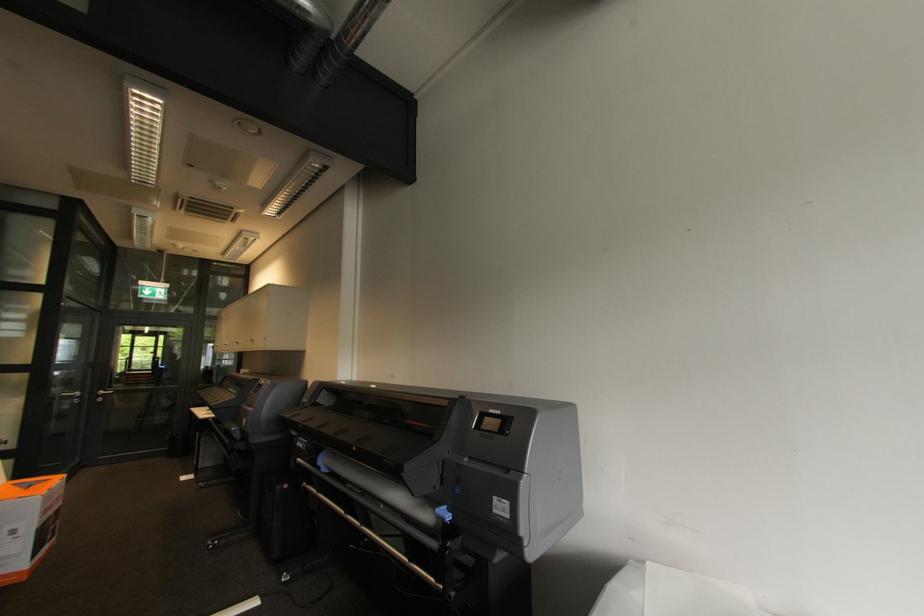
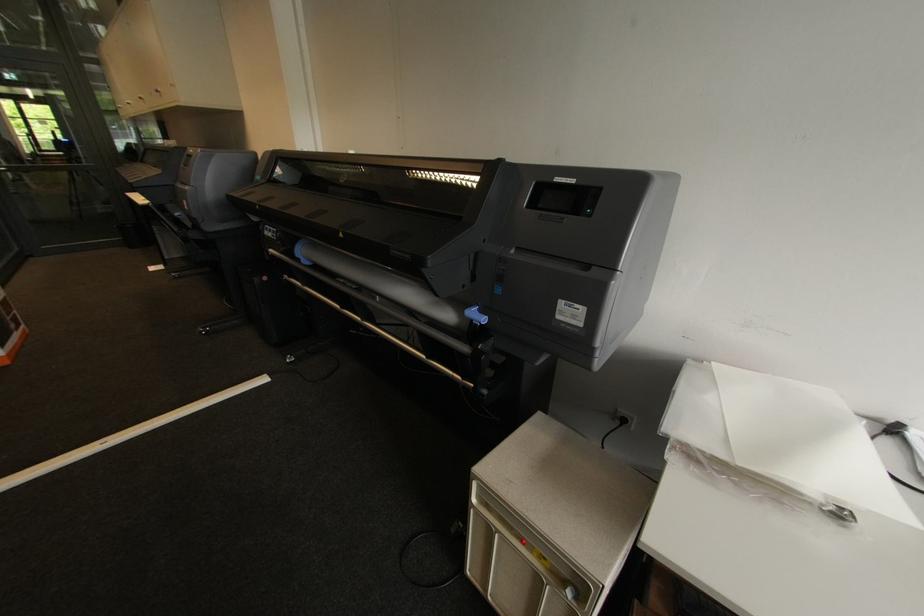
Find the pixel in the second image that matches pixel 499 512 in the first image.

(563, 318)